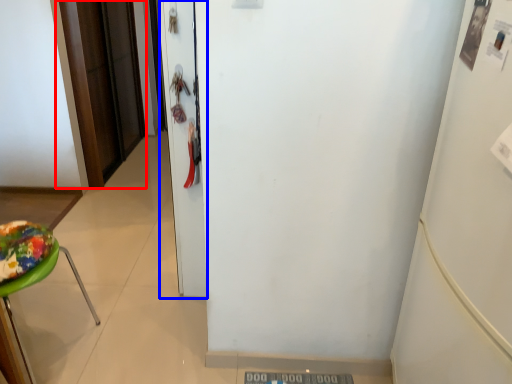
Question: Among these objects, which one is nearest to the camera, door (highlighted by a red box) or door (highlighted by a blue box)?

Choices:
 (A) door
 (B) door

Answer: (B)